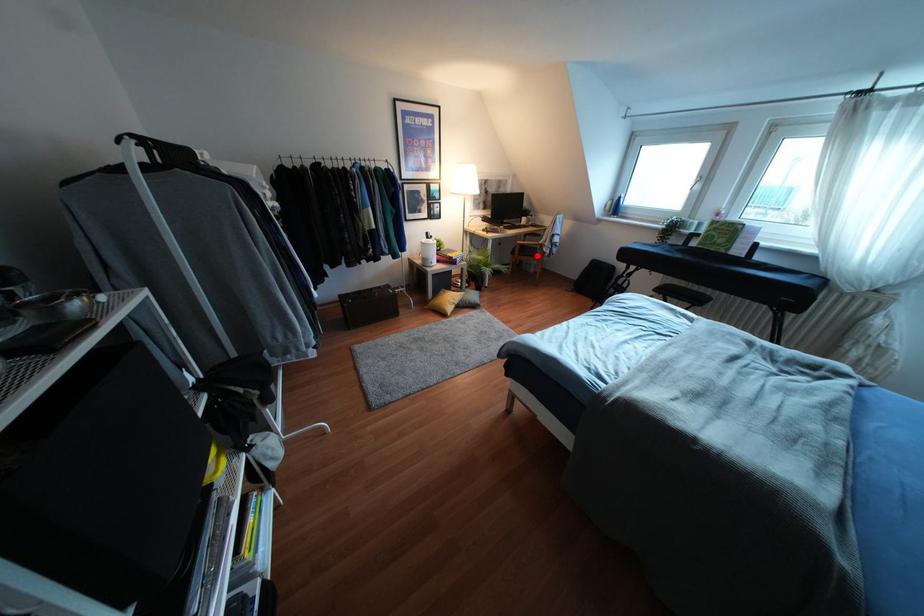
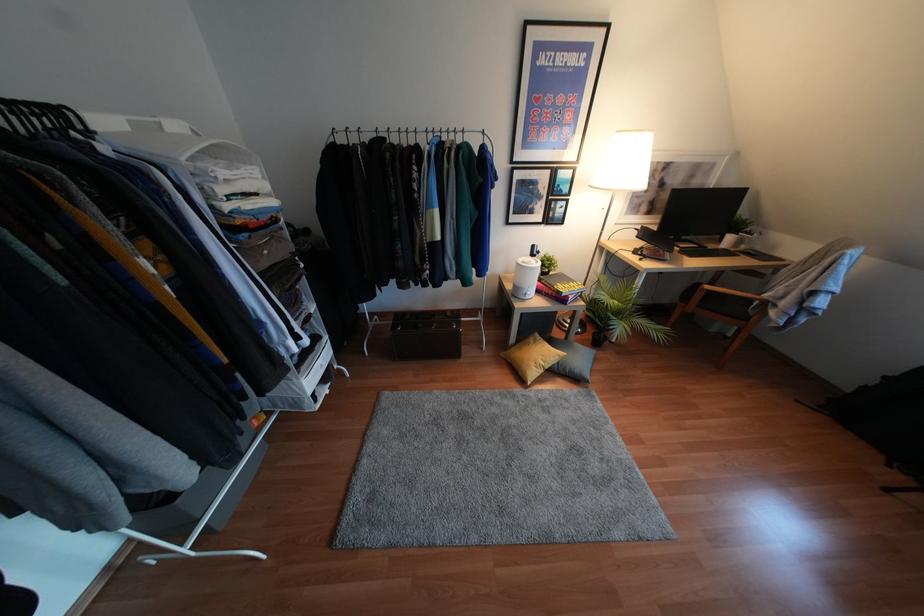
Question: A red point is marked in image1. In image2, is the corresponding 3D point closer to the camera or farther? Reply with the corresponding letter.

Choices:
 (A) The corresponding 3D point is closer.
 (B) The corresponding 3D point is farther.

Answer: (B)